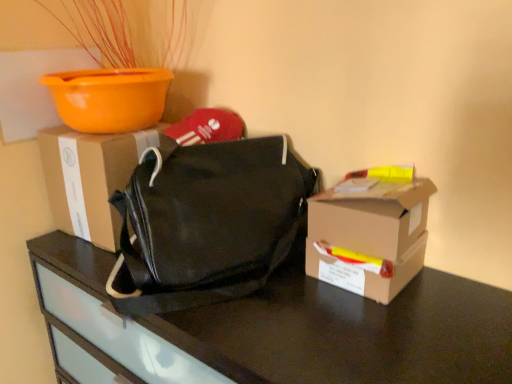
You are a GUI agent. You are given a task and a screenshot of the screen. Output one action in this format:
    pyautogui.click(x=<x>, y=<y>)
    Task: Click on the black matte bag at center
    
    Given the screenshot: What is the action you would take?
    pyautogui.click(x=274, y=329)

The width and height of the screenshot is (512, 384). What do you see at coordinates (92, 177) in the screenshot?
I see `matte cardboard box at center, the 1th box viewed from the back` at bounding box center [92, 177].

Measure the distance between point (x=268, y=274) and camera.

Point (x=268, y=274) is 35.24 inches from camera.

I want to click on black matte bag at center, so click(274, 329).

Considering the relative sizes of matte cardboard box at center, the second box from the front, and orange plastic bowl at upper left in the image provided, is matte cardboard box at center, the second box from the front, thinner than orange plastic bowl at upper left?

Yes, matte cardboard box at center, the second box from the front, is thinner than orange plastic bowl at upper left.

From the image's perspective, relative to orange plastic bowl at upper left, is matte cardboard box at center, the 1th box viewed from the back, above or below?

From the image's perspective, matte cardboard box at center, the 1th box viewed from the back, appears below orange plastic bowl at upper left.

Is matte cardboard box at center, the second box from the front, completely or partially outside of orange plastic bowl at upper left?

That's correct, matte cardboard box at center, the second box from the front, is outside of orange plastic bowl at upper left.

Is matte cardboard box at center, arranged as the 2th box when viewed from the right, aimed at orange plastic bowl at upper left?

No, matte cardboard box at center, arranged as the 2th box when viewed from the right, is not facing towards orange plastic bowl at upper left.

Between black canvas bag at center and brown cardboard box at right, placed as the 2th box when sorted from back to front, which one has larger width?

With larger width is black canvas bag at center.

Who is more distant, black canvas bag at center or brown cardboard box at right, which is the 2th box from left to right?

Positioned behind is brown cardboard box at right, which is the 2th box from left to right.

Can we say black canvas bag at center lies outside brown cardboard box at right, the 1th box in the right-to-left sequence?

Indeed, black canvas bag at center is completely outside brown cardboard box at right, the 1th box in the right-to-left sequence.

Which is more to the right, black canvas bag at center or brown cardboard box at right, the 1th box in the right-to-left sequence?

Positioned to the right is brown cardboard box at right, the 1th box in the right-to-left sequence.

Between brown cardboard box at right, the first box in the front-to-back sequence, and black canvas bag at center, which one is positioned in front?

black canvas bag at center is in front.

Is brown cardboard box at right, which is the 2th box from left to right, oriented away from black canvas bag at center?

brown cardboard box at right, which is the 2th box from left to right, is not turned away from black canvas bag at center.

Is brown cardboard box at right, the first box in the front-to-back sequence, with black canvas bag at center?

No, brown cardboard box at right, the first box in the front-to-back sequence, is not next to black canvas bag at center.

Does brown cardboard box at right, the first box in the front-to-back sequence, have a lesser height compared to black canvas bag at center?

Yes, brown cardboard box at right, the first box in the front-to-back sequence, is shorter than black canvas bag at center.

Is brown cardboard box at right, which is the 2th box from left to right, at the left side of matte cardboard box at center, the 1th box viewed from the back?

In fact, brown cardboard box at right, which is the 2th box from left to right, is to the right of matte cardboard box at center, the 1th box viewed from the back.

Is brown cardboard box at right, which is the 2th box from left to right, outside of matte cardboard box at center, arranged as the 2th box when viewed from the right?

brown cardboard box at right, which is the 2th box from left to right, is positioned outside matte cardboard box at center, arranged as the 2th box when viewed from the right.

Between brown cardboard box at right, placed as the 2th box when sorted from back to front, and matte cardboard box at center, arranged as the 2th box when viewed from the right, which one has larger width?

matte cardboard box at center, arranged as the 2th box when viewed from the right, is wider.

Between brown cardboard box at right, placed as the 2th box when sorted from back to front, and matte cardboard box at center, the second box from the front, which one is positioned behind?

matte cardboard box at center, the second box from the front, is further from the camera.

How much distance is there between black canvas bag at center and black matte bag at center?

black canvas bag at center and black matte bag at center are 16.87 centimeters apart from each other.

Considering the relative sizes of black canvas bag at center and black matte bag at center in the image provided, is black canvas bag at center shorter than black matte bag at center?

Correct, black canvas bag at center is not as tall as black matte bag at center.

From the image's perspective, which object appears higher, black canvas bag at center or black matte bag at center?

black canvas bag at center.

Is black canvas bag at center not close to black matte bag at center?

No.

At what (x,y) coordinates should I click in order to perform the action: click on box to the left of black canvas bag at center. Please return your answer as a coordinate pair (x, y). The height and width of the screenshot is (384, 512). Looking at the image, I should click on (92, 177).

Is black canvas bag at center oriented away from matte cardboard box at center, the 1th box viewed from the back?

Yes.

Is black canvas bag at center placed right next to matte cardboard box at center, acting as the 1th box starting from the left?

No, black canvas bag at center is not next to matte cardboard box at center, acting as the 1th box starting from the left.

Can you confirm if orange plastic bowl at upper left is shorter than black matte bag at center?

Indeed, orange plastic bowl at upper left has a lesser height compared to black matte bag at center.

Identify the location of desk in front of the orange plastic bowl at upper left. This screenshot has height=384, width=512. (274, 329).

Measure the distance from orange plastic bowl at upper left to black matte bag at center.

orange plastic bowl at upper left and black matte bag at center are 27.94 inches apart from each other.

Based on the photo, are orange plastic bowl at upper left and black matte bag at center located far from each other?

No.

Locate an element on the screen. The width and height of the screenshot is (512, 384). houseplant that is on the right side of matte cardboard box at center, the 1th box viewed from the back is located at coordinates (122, 60).

Locate an element on the screen. The height and width of the screenshot is (384, 512). handbag that is above the brown cardboard box at right, the 1th box in the right-to-left sequence (from a real-world perspective) is located at coordinates (207, 223).

Looking at the image, which one is located closer to brown cardboard box at right, the 1th box in the right-to-left sequence, orange plastic bowl at upper left or matte cardboard box at center, the 1th box viewed from the back?

Among the two, matte cardboard box at center, the 1th box viewed from the back, is located nearer to brown cardboard box at right, the 1th box in the right-to-left sequence.

Looking at the image, which one is located further to black canvas bag at center, black matte bag at center or orange plastic bowl at upper left?

Based on the image, orange plastic bowl at upper left appears to be further to black canvas bag at center.

Which object lies further to the anchor point orange plastic bowl at upper left, matte cardboard box at center, the second box from the front, or black canvas bag at center?

Based on the image, black canvas bag at center appears to be further to orange plastic bowl at upper left.

When comparing their distances from black canvas bag at center, does matte cardboard box at center, arranged as the 2th box when viewed from the right, or black matte bag at center seem further?

Among the two, matte cardboard box at center, arranged as the 2th box when viewed from the right, is located further to black canvas bag at center.

From the image, which object appears to be nearer to black matte bag at center, matte cardboard box at center, arranged as the 2th box when viewed from the right, or black canvas bag at center?

The object closer to black matte bag at center is black canvas bag at center.

When comparing their distances from matte cardboard box at center, arranged as the 2th box when viewed from the right, does black matte bag at center or orange plastic bowl at upper left seem further?

The object further to matte cardboard box at center, arranged as the 2th box when viewed from the right, is orange plastic bowl at upper left.

From the image, which object appears to be nearer to black canvas bag at center, matte cardboard box at center, the second box from the front, or orange plastic bowl at upper left?

matte cardboard box at center, the second box from the front, is closer to black canvas bag at center.

Considering their positions, is black canvas bag at center positioned closer to matte cardboard box at center, the 1th box viewed from the back, than black matte bag at center?

Among the two, black canvas bag at center is located nearer to matte cardboard box at center, the 1th box viewed from the back.

Where is `handbag between orange plastic bowl at upper left and brown cardboard box at right, the 1th box in the right-to-left sequence`? The height and width of the screenshot is (384, 512). handbag between orange plastic bowl at upper left and brown cardboard box at right, the 1th box in the right-to-left sequence is located at coordinates (207, 223).

Find the location of a particular element. This screenshot has width=512, height=384. box that lies between black canvas bag at center and black matte bag at center from top to bottom is located at coordinates (368, 236).

I want to click on handbag between matte cardboard box at center, the 1th box viewed from the back, and black matte bag at center, in the vertical direction, so click(x=207, y=223).

Identify the location of handbag between orange plastic bowl at upper left and black matte bag at center in the vertical direction. (207, 223).